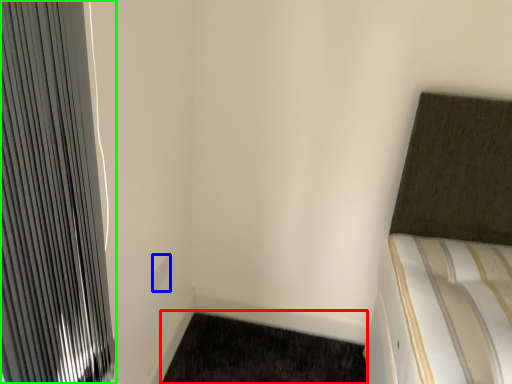
Question: Which is farther away from doormat (highlighted by a red box)? electric outlet (highlighted by a blue box) or radiator (highlighted by a green box)?

Choices:
 (A) electric outlet
 (B) radiator

Answer: (B)